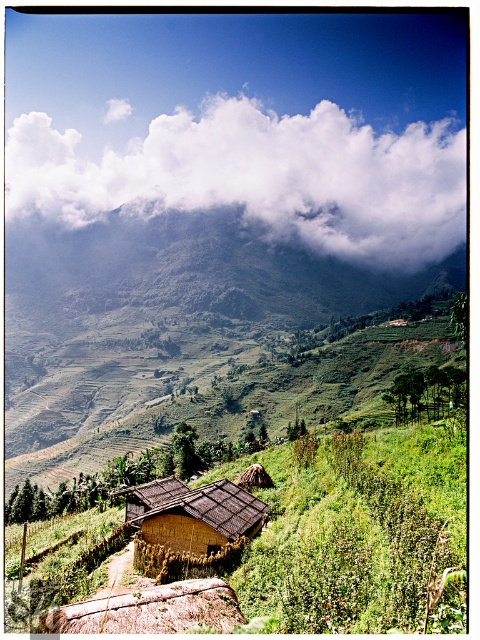
Question: Which object is the closest to the white fluffy cloud at upper center?

Choices:
 (A) green grassy mountain at upper center
 (B) brown thatched hut at center

Answer: (A)

Question: Considering the real-world distances, which object is closest to the green grassy mountain at upper center?

Choices:
 (A) white fluffy cloud at upper center
 (B) brown thatched hut at center

Answer: (A)

Question: In this image, where is green grassy mountain at upper center located relative to brown thatched hut at center?

Choices:
 (A) above
 (B) below

Answer: (A)

Question: Does white fluffy cloud at upper center have a lesser width compared to green grassy mountain at upper center?

Choices:
 (A) yes
 (B) no

Answer: (B)

Question: Observing the image, what is the correct spatial positioning of white fluffy cloud at upper center in reference to green grassy mountain at upper center?

Choices:
 (A) left
 (B) right

Answer: (B)

Question: Which point is closer to the camera taking this photo?

Choices:
 (A) (14, 230)
 (B) (168, 536)
 (C) (266, 216)

Answer: (B)